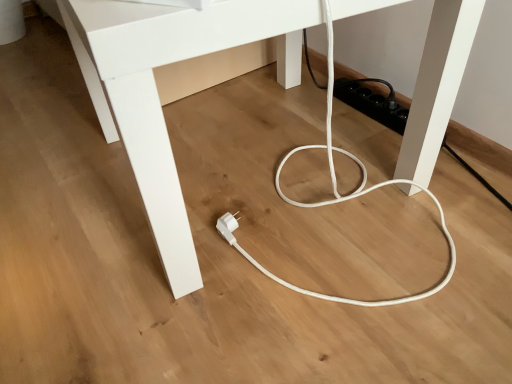
Measure the distance between point (162, 212) and camera.

Point (162, 212) and camera are 22.52 inches apart from each other.

What do you see at coordinates (157, 92) in the screenshot? Image resolution: width=512 pixels, height=384 pixels. I see `white glossy table at center` at bounding box center [157, 92].

The height and width of the screenshot is (384, 512). I want to click on white glossy table at center, so click(157, 92).

This screenshot has height=384, width=512. I want to click on white glossy table at center, so click(157, 92).